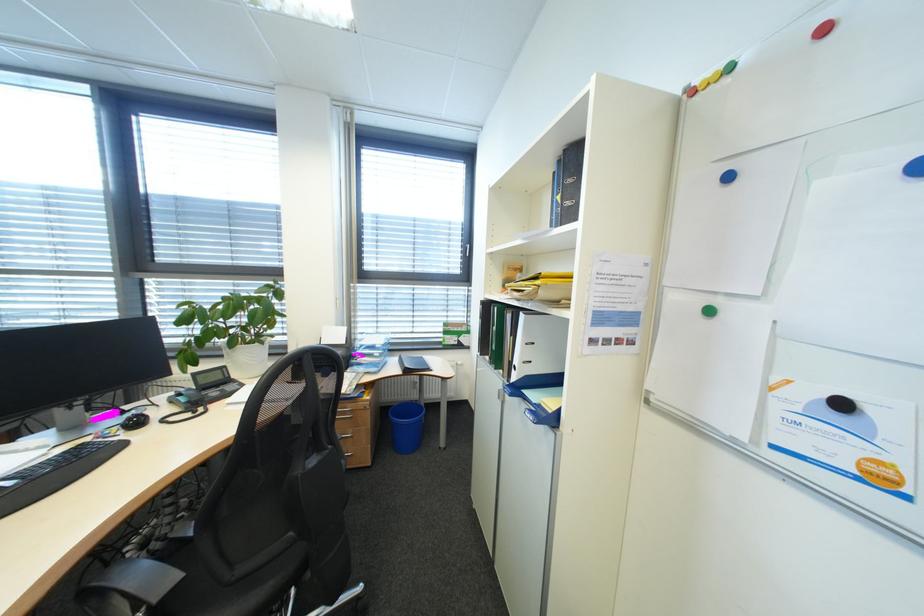
Where is `black chair armrest`? The width and height of the screenshot is (924, 616). black chair armrest is located at coordinates (139, 578).